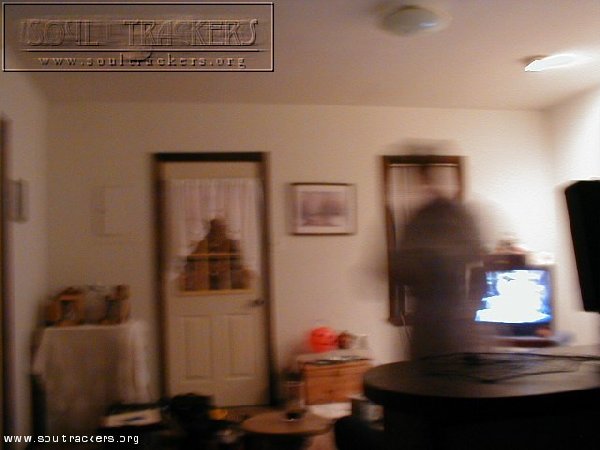
This screenshot has width=600, height=450. I want to click on wall, so click(x=60, y=214), click(x=309, y=251), click(x=515, y=195).